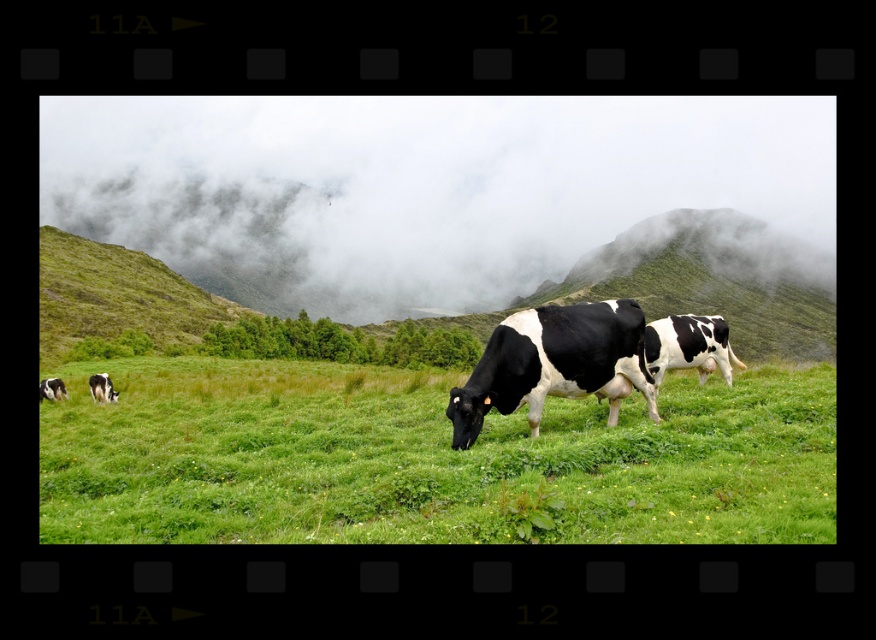
You are standing in the field and see the green grassy pasture at center and the black and white spotted cow at center. Which one is positioned to the left of the other?

The green grassy pasture at center is to the left of the black and white spotted cow at center.

You are a photographer trying to capture the black and white spotted cow at center and the foggy misty clouds at upper center in a single frame. Which object will appear larger in your photo?

The foggy misty clouds at upper center will appear larger in the photo because they are bigger than the black and white spotted cow at center.